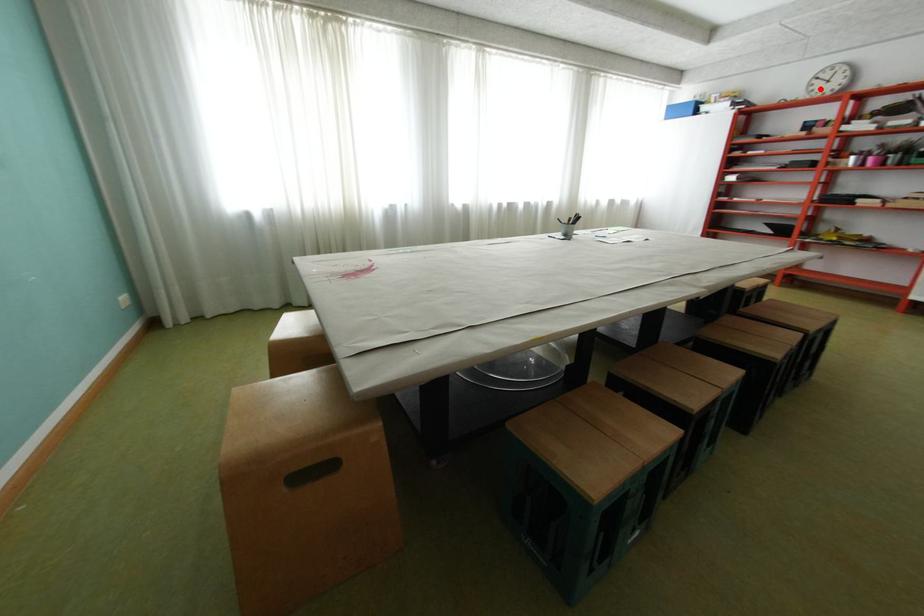
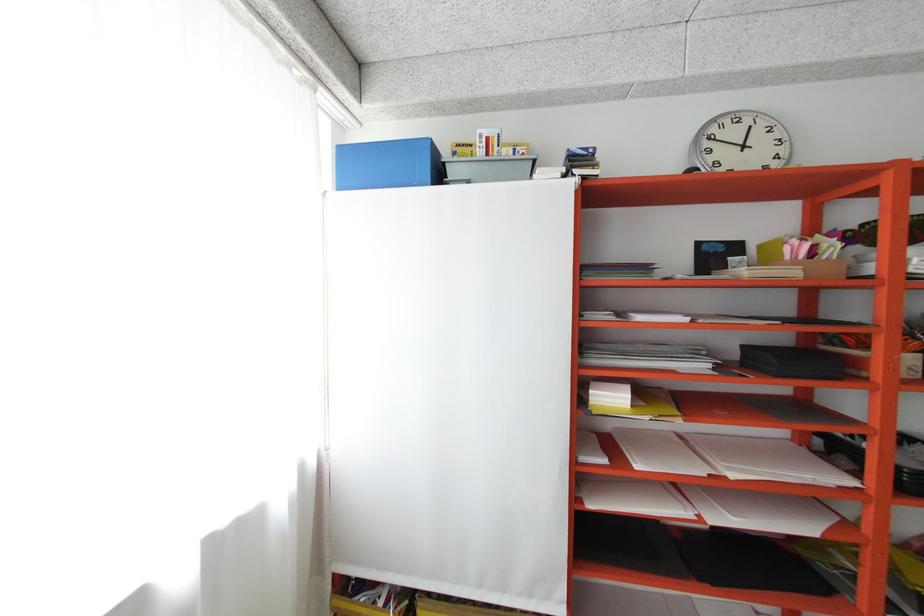
Question: I am providing you with two images of the same scene from different viewpoints. In image1, a red point is highlighted. Considering the same 3D point in image2, which of the following is correct?

Choices:
 (A) It is closer
 (B) It is farther

Answer: (A)